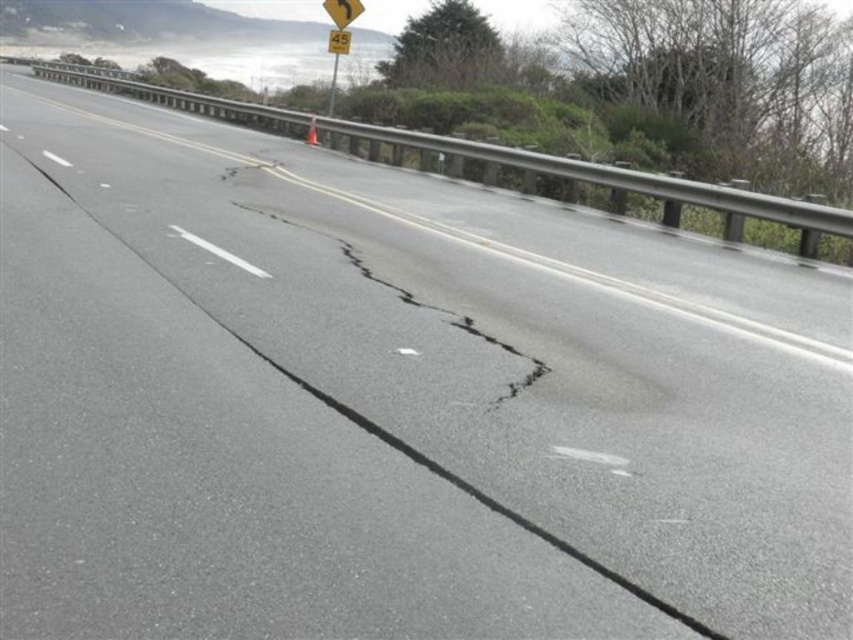
You are driving on a highway and see two signs at the upper center of your view. The signs are labeled as yellow matte sign at upper center and yellow plastic sign at upper center. Which one is shorter?

The yellow matte sign at upper center is shorter than the yellow plastic sign at upper center.

You are standing on the road and looking towards the guardrail. There are two points marked on the road surface. The first point is at coordinates point (274, 312) and the second point is at point (343, 13). Which point is closer to you?

Point (274, 312) is closer to the camera than point (343, 13), so the first point is closer to you.

You are a road inspector checking the condition of the road. You notice the black asphalt crack at center and the yellow matte sign at upper center. Which one has a greater width?

The black asphalt crack at center has a greater width than the yellow matte sign at upper center.